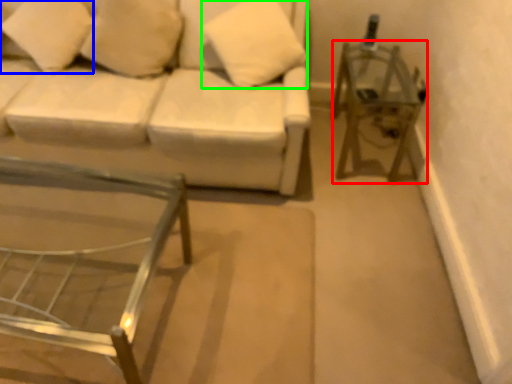
Question: Estimate the real-world distances between objects in this image. Which object is closer to side table (highlighted by a red box), pillow (highlighted by a blue box) or pillow (highlighted by a green box)?

Choices:
 (A) pillow
 (B) pillow

Answer: (B)